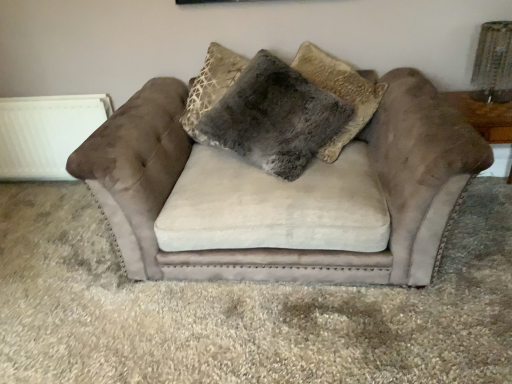
Question: Is the position of fuzzy gray pillow at center less distant than that of white matte radiator at left?

Choices:
 (A) yes
 (B) no

Answer: (A)

Question: Can you confirm if fuzzy gray pillow at center is positioned to the left of white matte radiator at left?

Choices:
 (A) no
 (B) yes

Answer: (A)

Question: Is fuzzy gray pillow at center directly adjacent to white matte radiator at left?

Choices:
 (A) no
 (B) yes

Answer: (A)

Question: Is fuzzy gray pillow at center outside of white matte radiator at left?

Choices:
 (A) no
 (B) yes

Answer: (B)

Question: Does fuzzy gray pillow at center have a larger size compared to white matte radiator at left?

Choices:
 (A) yes
 (B) no

Answer: (A)

Question: Is fuzzy gray pillow at center taller or shorter than brown suede table at right?

Choices:
 (A) tall
 (B) short

Answer: (A)

Question: From the image's perspective, is fuzzy gray pillow at center above or below brown suede table at right?

Choices:
 (A) above
 (B) below

Answer: (A)

Question: From a real-world perspective, relative to brown suede table at right, is fuzzy gray pillow at center vertically above or below?

Choices:
 (A) above
 (B) below

Answer: (A)

Question: Does point click(209, 119) appear closer or farther from the camera than point click(477, 102)?

Choices:
 (A) closer
 (B) farther

Answer: (A)

Question: Considering their positions, is fuzzy gray pillow at center located in front of or behind suede couch at center?

Choices:
 (A) behind
 (B) front

Answer: (A)

Question: Considering the positions of fuzzy gray pillow at center and suede couch at center in the image, is fuzzy gray pillow at center wider or thinner than suede couch at center?

Choices:
 (A) wide
 (B) thin

Answer: (B)

Question: Is fuzzy gray pillow at center inside the boundaries of suede couch at center, or outside?

Choices:
 (A) outside
 (B) inside

Answer: (B)

Question: From a real-world perspective, is fuzzy gray pillow at center positioned above or below suede couch at center?

Choices:
 (A) below
 (B) above

Answer: (B)

Question: Considering the positions of point (140, 172) and point (487, 112), is point (140, 172) closer or farther from the camera than point (487, 112)?

Choices:
 (A) closer
 (B) farther

Answer: (A)

Question: Considering the positions of suede couch at center and brown suede table at right in the image, is suede couch at center taller or shorter than brown suede table at right?

Choices:
 (A) tall
 (B) short

Answer: (A)